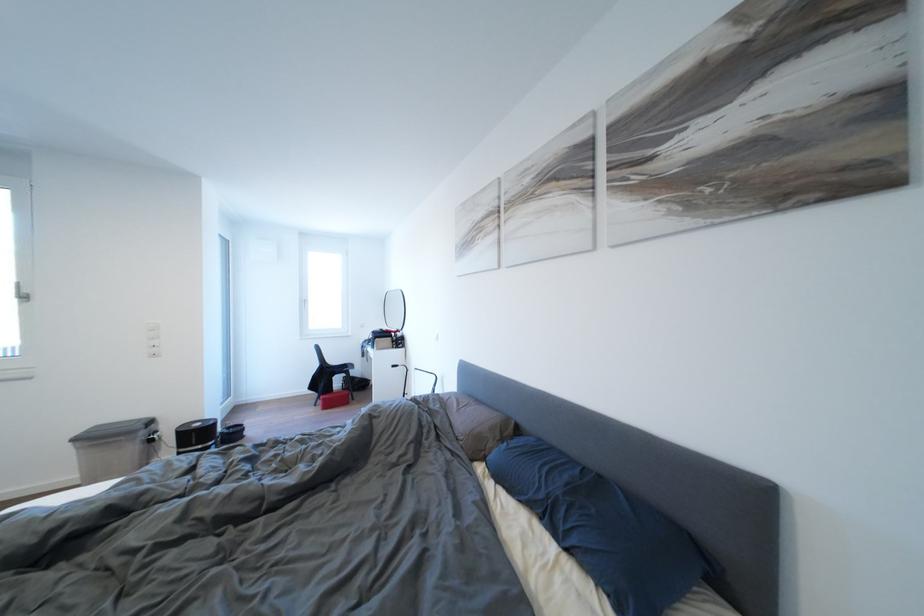
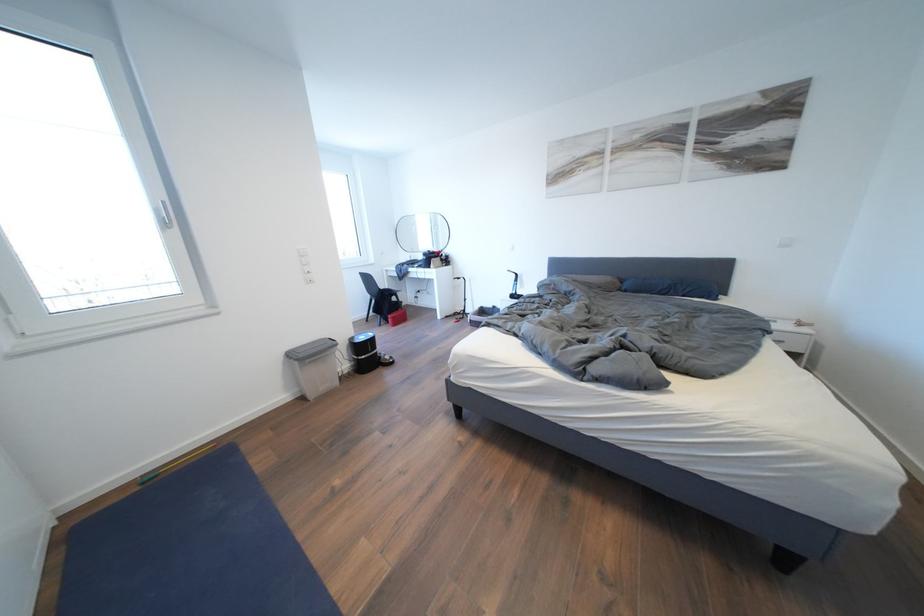
Question: In a continuous first-person perspective shot, in which direction is the camera moving?

Choices:
 (A) Left
 (B) Right
 (C) Forward
 (D) Backward

Answer: (A)